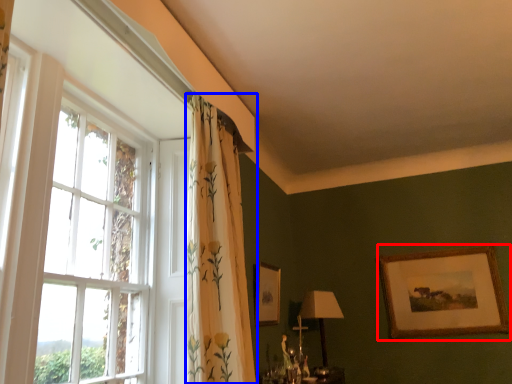
Question: Which point is closer to the camera, picture frame (highlighted by a red box) or curtain (highlighted by a blue box)?

Choices:
 (A) picture frame
 (B) curtain

Answer: (B)